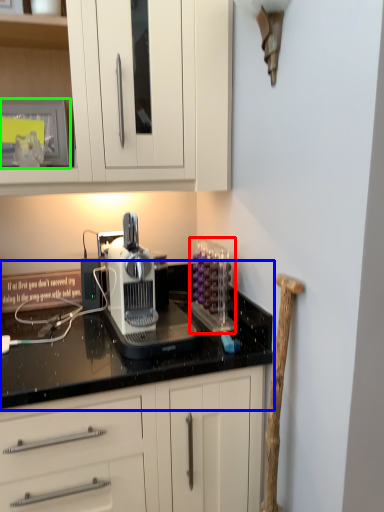
Question: Which object is the farthest from kitchen appliance (highlighted by a red box)? Choose among these: countertop (highlighted by a blue box) or appliance (highlighted by a green box).

Choices:
 (A) countertop
 (B) appliance

Answer: (B)